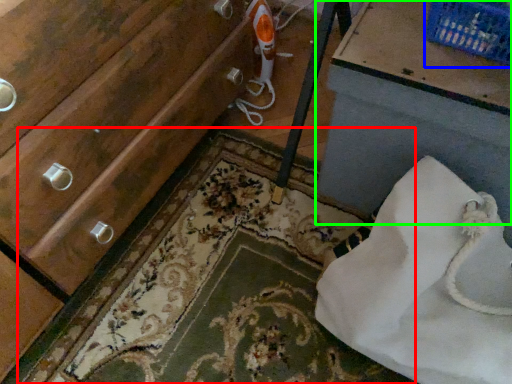
Question: Considering the real-world distances, which object is farthest from bath mat (highlighted by a red box)? basket (highlighted by a blue box) or vanity (highlighted by a green box)?

Choices:
 (A) basket
 (B) vanity

Answer: (A)